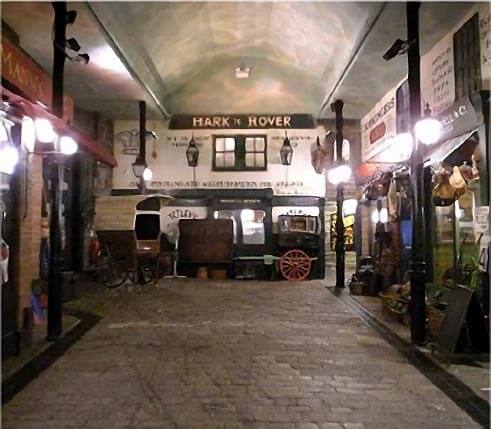
Find the location of a particular element. The image size is (491, 429). lamp right of segmented windows is located at coordinates (284, 150).